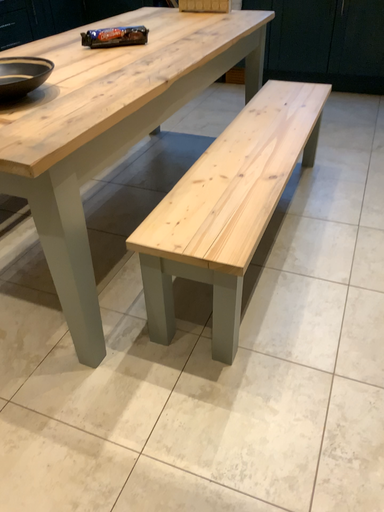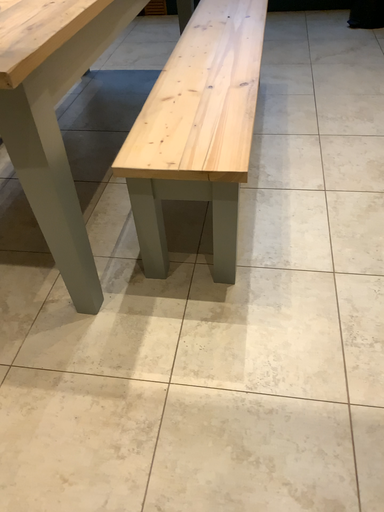
Question: How did the camera likely rotate when shooting the video?

Choices:
 (A) rotated right
 (B) rotated left

Answer: (A)